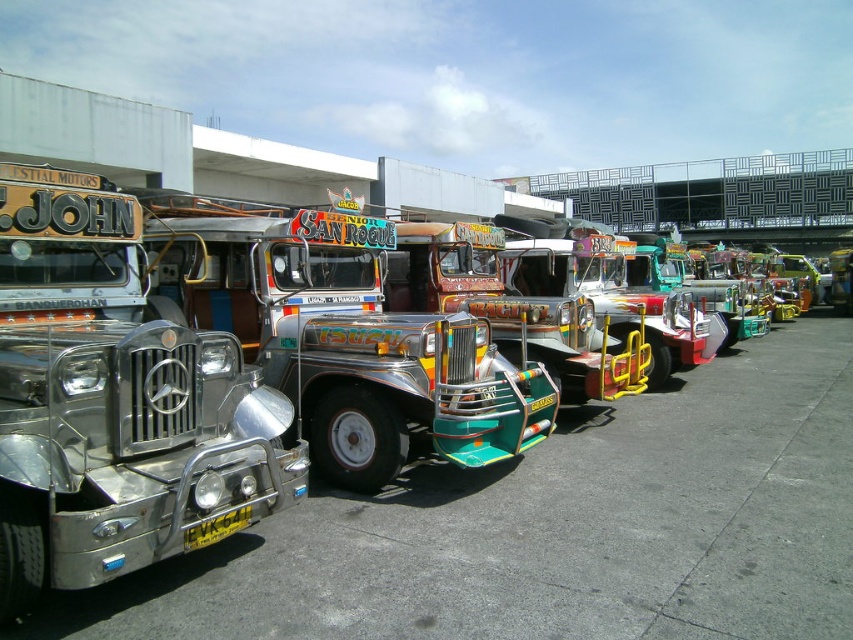
Question: Which point is farther to the camera?

Choices:
 (A) (461, 589)
 (B) (351, 346)
 (C) (189, 339)

Answer: (B)

Question: Can you confirm if shiny silver trailer truck at left is positioned above shiny metallic bus at center?

Choices:
 (A) no
 (B) yes

Answer: (A)

Question: Does shiny metallic bus at left have a larger size compared to shiny chrome trailer truck at center?

Choices:
 (A) yes
 (B) no

Answer: (A)

Question: Is shiny chrome trailer truck at center thinner than shiny metallic bus at center?

Choices:
 (A) no
 (B) yes

Answer: (A)

Question: Which object is closer to the camera taking this photo?

Choices:
 (A) shiny metallic bus at center
 (B) shiny silver trailer truck at left
 (C) shiny chrome trailer truck at center
 (D) shiny metallic bus at left

Answer: (B)

Question: Based on their relative distances, which object is farther from the shiny silver trailer truck at left?

Choices:
 (A) shiny chrome trailer truck at center
 (B) shiny metallic bus at left
 (C) shiny metallic bus at center

Answer: (C)